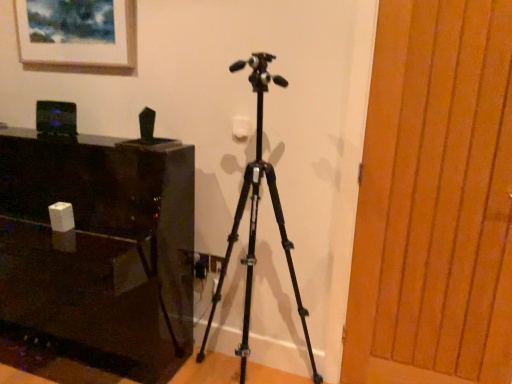
Question: Is glossy black table at left directly adjacent to black matte tripod at center?

Choices:
 (A) yes
 (B) no

Answer: (B)

Question: Is glossy black table at left aimed at black matte tripod at center?

Choices:
 (A) no
 (B) yes

Answer: (A)

Question: Does glossy black table at left have a lesser height compared to black matte tripod at center?

Choices:
 (A) yes
 (B) no

Answer: (A)

Question: Is glossy black table at left at the left side of black matte tripod at center?

Choices:
 (A) no
 (B) yes

Answer: (B)

Question: Considering the relative positions of glossy black table at left and black matte tripod at center in the image provided, is glossy black table at left to the right of black matte tripod at center from the viewer's perspective?

Choices:
 (A) no
 (B) yes

Answer: (A)

Question: Considering the relative sizes of glossy black table at left and black matte tripod at center in the image provided, is glossy black table at left smaller than black matte tripod at center?

Choices:
 (A) no
 (B) yes

Answer: (A)

Question: Can you confirm if matte wooden picture frame at upper left is taller than black matte tripod at center?

Choices:
 (A) yes
 (B) no

Answer: (B)

Question: Does matte wooden picture frame at upper left have a lesser width compared to black matte tripod at center?

Choices:
 (A) no
 (B) yes

Answer: (B)

Question: Considering the relative sizes of matte wooden picture frame at upper left and black matte tripod at center in the image provided, is matte wooden picture frame at upper left bigger than black matte tripod at center?

Choices:
 (A) yes
 (B) no

Answer: (B)

Question: Is matte wooden picture frame at upper left further to camera compared to black matte tripod at center?

Choices:
 (A) yes
 (B) no

Answer: (A)

Question: Can you confirm if matte wooden picture frame at upper left is smaller than black matte tripod at center?

Choices:
 (A) no
 (B) yes

Answer: (B)

Question: Is matte wooden picture frame at upper left in front of black matte tripod at center?

Choices:
 (A) no
 (B) yes

Answer: (A)

Question: Is matte wooden picture frame at upper left located outside glossy black table at left?

Choices:
 (A) no
 (B) yes

Answer: (B)